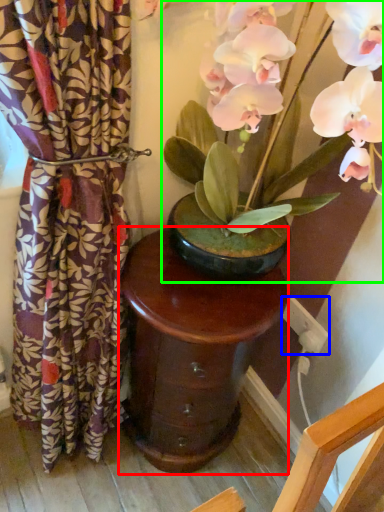
Question: Which is nearer to the table (highlighted by a red box)? electric outlet (highlighted by a blue box) or houseplant (highlighted by a green box).

Choices:
 (A) electric outlet
 (B) houseplant

Answer: (B)